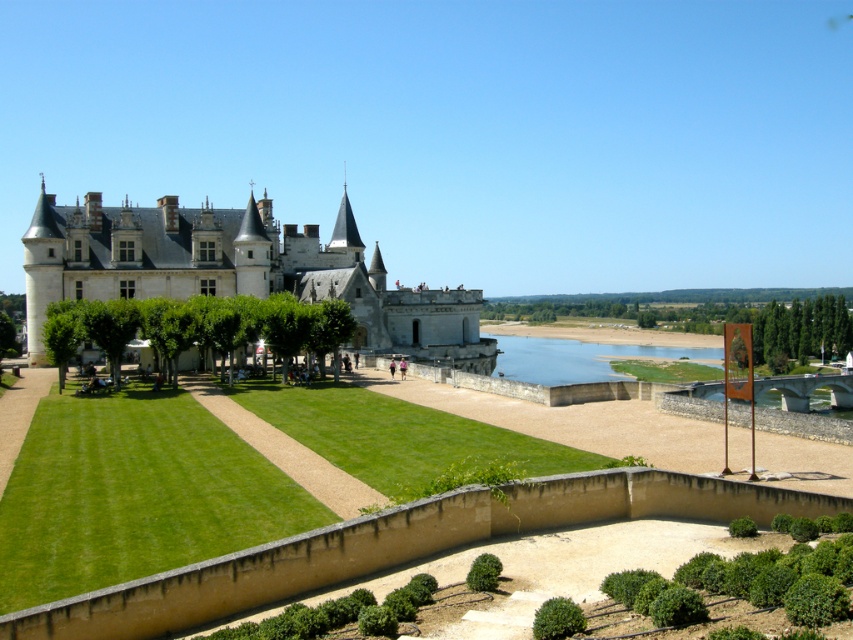
Question: Which point is farther to the camera?

Choices:
 (A) white stone castle at center
 (B) brown stone moat at lower center
 (C) green grassy lake at lower center

Answer: (C)

Question: Is white stone castle at center to the right of green grassy lake at lower center from the viewer's perspective?

Choices:
 (A) no
 (B) yes

Answer: (A)

Question: Does brown stone moat at lower center have a smaller size compared to green grassy lake at lower center?

Choices:
 (A) yes
 (B) no

Answer: (A)

Question: Which point appears farthest from the camera in this image?

Choices:
 (A) (576, 352)
 (B) (386, 314)

Answer: (A)

Question: Does white stone castle at center appear under green grassy lake at lower center?

Choices:
 (A) no
 (B) yes

Answer: (A)

Question: Which point is farther to the camera?

Choices:
 (A) (699, 520)
 (B) (674, 346)

Answer: (B)